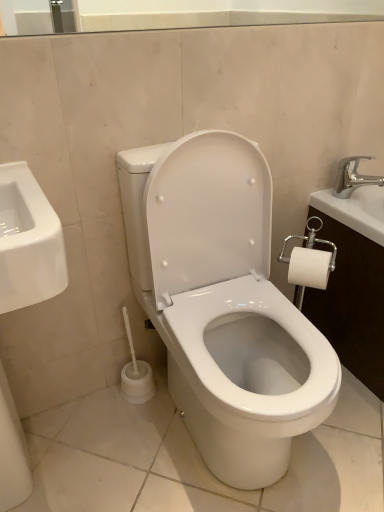
Question: Is white glossy toilet at center at the right side of silver metallic faucet at upper right?

Choices:
 (A) yes
 (B) no

Answer: (B)

Question: Is white glossy toilet at center turned away from silver metallic faucet at upper right?

Choices:
 (A) yes
 (B) no

Answer: (B)

Question: Is white glossy toilet at center smaller than silver metallic faucet at upper right?

Choices:
 (A) yes
 (B) no

Answer: (B)

Question: Does white glossy toilet at center have a lesser height compared to silver metallic faucet at upper right?

Choices:
 (A) yes
 (B) no

Answer: (B)

Question: Is white glossy toilet at center far away from silver metallic faucet at upper right?

Choices:
 (A) yes
 (B) no

Answer: (B)

Question: From a real-world perspective, is white glossy toilet at center positioned over silver metallic faucet at upper right based on gravity?

Choices:
 (A) yes
 (B) no

Answer: (B)

Question: Is white glossy toilet at center a part of silver metallic faucet at upper right?

Choices:
 (A) yes
 (B) no

Answer: (B)

Question: Does silver metallic faucet at upper right have a larger size compared to white glossy toilet at center?

Choices:
 (A) yes
 (B) no

Answer: (B)

Question: Is silver metallic faucet at upper right outside white glossy toilet at center?

Choices:
 (A) yes
 (B) no

Answer: (A)

Question: Is silver metallic faucet at upper right touching white glossy toilet at center?

Choices:
 (A) no
 (B) yes

Answer: (A)

Question: Is silver metallic faucet at upper right to the right of white glossy toilet at center from the viewer's perspective?

Choices:
 (A) no
 (B) yes

Answer: (B)

Question: Does silver metallic faucet at upper right have a lesser height compared to white glossy toilet at center?

Choices:
 (A) yes
 (B) no

Answer: (A)

Question: From a real-world perspective, relative to silver metallic faucet at upper right, is white glossy toilet at center vertically above or below?

Choices:
 (A) above
 (B) below

Answer: (B)